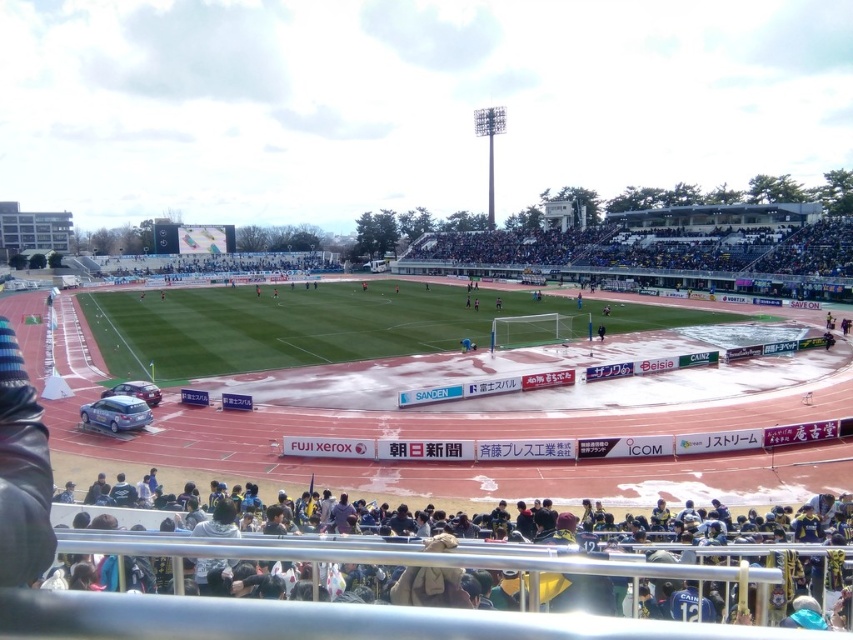
Which of these two, dark blue fabric at lower center or satin blue sedan at lower left, stands taller?

dark blue fabric at lower center is taller.

Does dark blue fabric at lower center have a smaller size compared to satin blue sedan at lower left?

Incorrect, dark blue fabric at lower center is not smaller in size than satin blue sedan at lower left.

Does point (380, 556) come closer to viewer compared to point (100, 416)?

Yes, point (380, 556) is closer to viewer.

At what (x,y) coordinates should I click in order to perform the action: click on dark blue fabric at lower center. Please return your answer as a coordinate pair (x, y). Looking at the image, I should click on (463, 560).

Can you confirm if satin blue sedan at lower left is bigger than satin silver car at lower left?

Yes.

From the picture: Which is more to the left, satin blue sedan at lower left or satin silver car at lower left?

satin silver car at lower left

Is point (120, 416) farther from camera compared to point (125, 392)?

No, (120, 416) is closer to viewer.

Where is `satin blue sedan at lower left`? satin blue sedan at lower left is located at coordinates (115, 413).

Does dark blue fabric at lower center lie behind satin silver car at lower left?

No, dark blue fabric at lower center is closer to the viewer.

Which is behind, point (334, 592) or point (154, 397)?

The point (154, 397) is behind.

Locate an element on the screen. This screenshot has width=853, height=640. dark blue fabric at lower center is located at coordinates (463, 560).